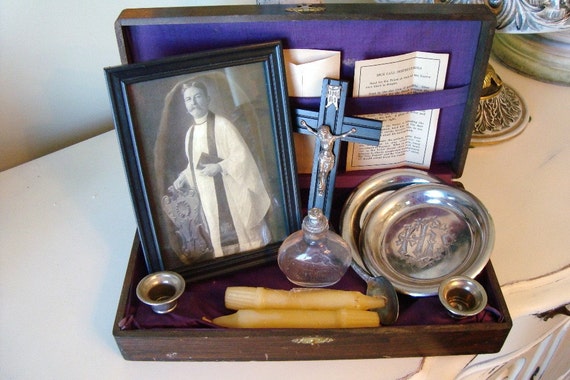
You are a GUI agent. You are given a task and a screenshot of the screen. Output one action in this format:
    pyautogui.click(x=<x>, y=<y>)
    Task: Click on the glass perfume bottle
    
    Given the screenshot: What is the action you would take?
    pyautogui.click(x=325, y=255)